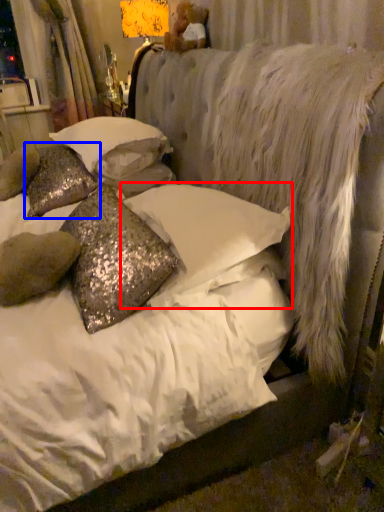
Question: Among these objects, which one is farthest to the camera, pillow (highlighted by a red box) or pillow (highlighted by a blue box)?

Choices:
 (A) pillow
 (B) pillow

Answer: (B)